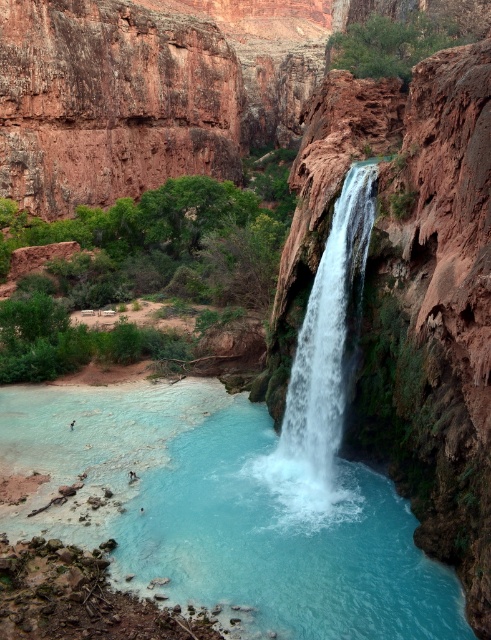
Is the position of clear blue water at center more distant than that of white frothy water at center?

No.

Is point (220, 566) closer to camera compared to point (292, 470)?

Yes, it is in front of point (292, 470).

Is point (222, 392) behind point (371, 225)?

That is True.

The width and height of the screenshot is (491, 640). Identify the location of clear blue water at center. (232, 512).